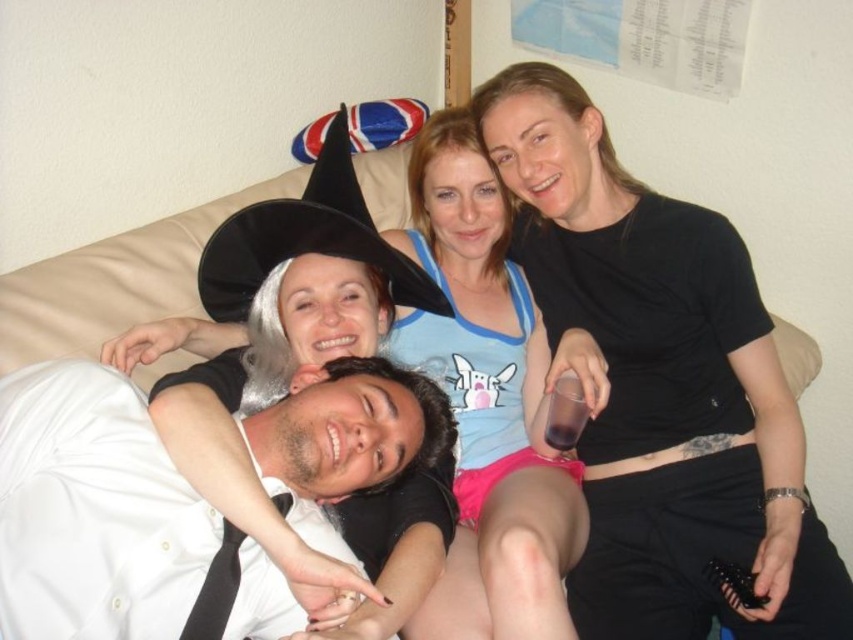
You are a photographer trying to capture a clear shot of both the matte black witch hat at upper center and the white glossy shirt at lower left. However, you notice that one of these items is partially blocking the other. Which item is being blocked by the other?

The white glossy shirt at lower left is behind matte black witch hat at upper center, so the white glossy shirt at lower left is being blocked by the matte black witch hat at upper center.

You are taking a photo of the group sitting on the beige couch. You notice two points marked at coordinates point (584, 323) and point (396, 419). Which point is closer to the camera?

Point (584, 323) is further to the camera than point (396, 419), so the closer point to the camera is point (396, 419).

You are a photographer trying to capture a closeup of the black matte shirt at upper right and the matte black witch hat at upper center in the image. Given that your camera has a focal length of 50mm and you want to ensure both objects are in focus, what is the minimum distance you should maintain from the closest object to achieve sharp focus on both?

The black matte shirt at upper right is 27.07 centimeters from the matte black witch hat at upper center. To ensure both are in focus with a 50mm lens, the minimum focusing distance should be calculated using the hyperfocal distance formula, but practically, maintaining at least 30 centimeters from the closest object should suffice for acceptable sharpness.